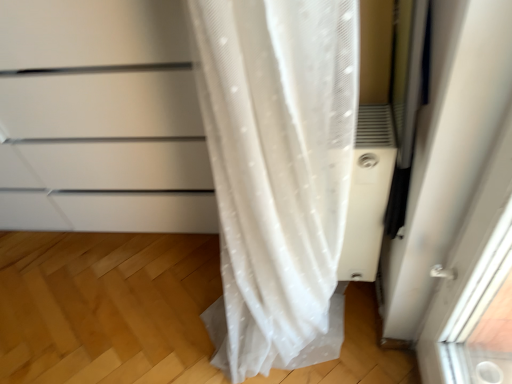
Question: In terms of height, does white plastic air conditioner at right look taller or shorter compared to white matte cabinet at left?

Choices:
 (A) tall
 (B) short

Answer: (B)

Question: Relative to white matte cabinet at left, is white plastic air conditioner at right in front or behind?

Choices:
 (A) behind
 (B) front

Answer: (A)

Question: Would you say white plastic air conditioner at right is to the left or to the right of white matte cabinet at left in the picture?

Choices:
 (A) left
 (B) right

Answer: (B)

Question: From a real-world perspective, relative to white plastic air conditioner at right, is white matte cabinet at left vertically above or below?

Choices:
 (A) below
 (B) above

Answer: (B)

Question: Is white matte cabinet at left bigger or smaller than white plastic air conditioner at right?

Choices:
 (A) big
 (B) small

Answer: (A)

Question: Is point 76,67 closer or farther from the camera than point 378,142?

Choices:
 (A) farther
 (B) closer

Answer: (A)

Question: Choose the correct answer: Is white matte cabinet at left inside white plastic air conditioner at right or outside it?

Choices:
 (A) inside
 (B) outside

Answer: (B)